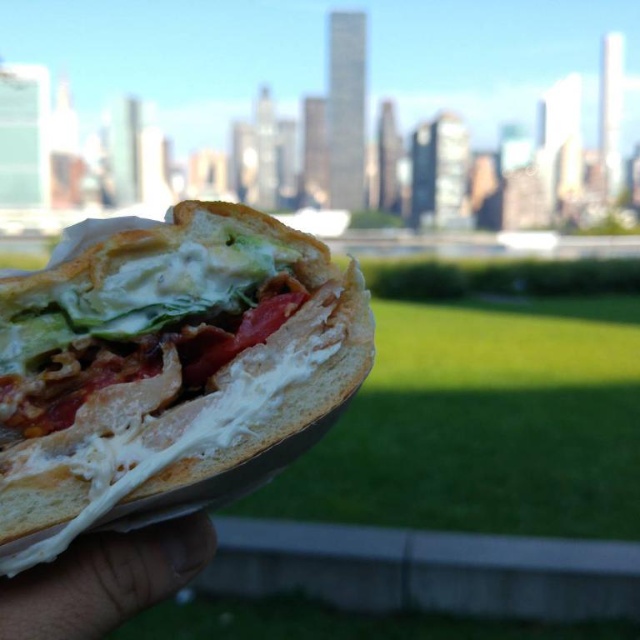
You are standing in a park and see two points in the distance. The first point is at coordinates point (x=36, y=554) and the second is at point (x=60, y=579). Based on the image, which point is closer to you?

Point (x=36, y=554) is in front of point (x=60, y=579), so it is closer to you.

You are a photographer trying to capture the white soft bread at center in focus while also including the skinny white hand at lower left in the shot. Since the hand is behind the bread, which part should you focus on to ensure both are sharp?

The skinny white hand at lower left is behind the white soft bread at center, so focusing on the bread will keep both in focus as the hand is closer to the camera.

You are a food critic trying to take a photo of the sandwich. You notice the white soft bread at center and the skinny white hand at lower left in your frame. Which object should you adjust to ensure the sandwich is the main focus?

The white soft bread at center is wider than the skinny white hand at lower left, so you should adjust the skinny white hand at lower left to move it out of the main focus area to make the white soft bread at center stand out more.